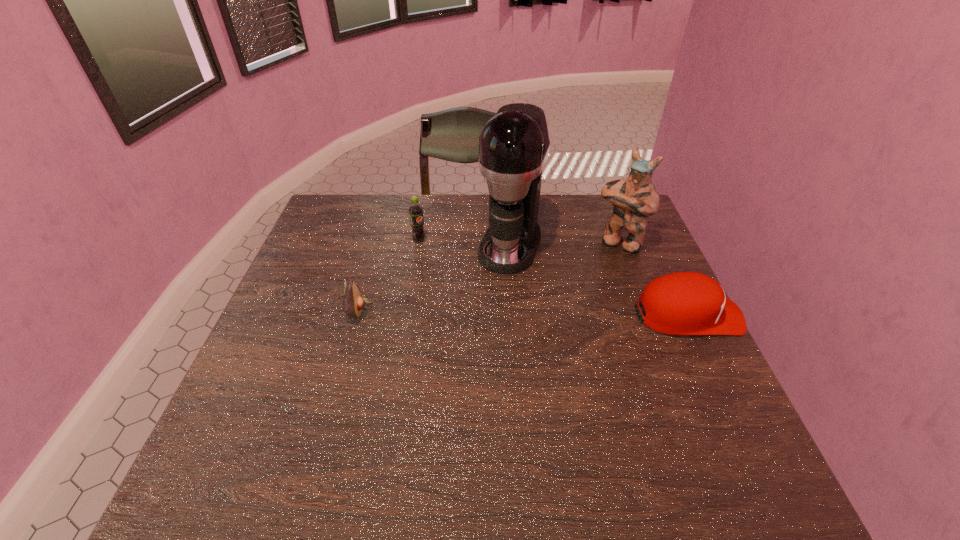
Where is `free space located on the front-facing side of the second tallest object`? free space located on the front-facing side of the second tallest object is located at coordinates (559, 326).

Locate an element on the screen. The height and width of the screenshot is (540, 960). free space located place cup under the spout of the tallest object is located at coordinates (481, 324).

I want to click on free space located 0.280m place cup under the spout of the tallest object, so click(x=471, y=348).

This screenshot has height=540, width=960. I want to click on free spot located 0.340m place cup under the spout of the tallest object, so click(463, 368).

This screenshot has height=540, width=960. In order to click on blank space located on the front label of the second object from left to right in this screenshot , I will do `click(455, 268)`.

Where is `free space located 0.400m on the front label of the second object from left to right`? The image size is (960, 540). free space located 0.400m on the front label of the second object from left to right is located at coordinates (518, 316).

The width and height of the screenshot is (960, 540). I want to click on vacant area located 0.230m on the front label of the second object from left to right, so (x=474, y=282).

You are a GUI agent. You are given a task and a screenshot of the screen. Output one action in this format:
    pyautogui.click(x=<x>, y=<y>)
    Task: Click on the figurine that is positioned at the far edge
    The height and width of the screenshot is (540, 960).
    Given the screenshot: What is the action you would take?
    pyautogui.click(x=634, y=199)

Image resolution: width=960 pixels, height=540 pixels. I want to click on coffee maker that is at the far edge, so click(x=514, y=144).

Find the location of `baseball cap at the right edge`. baseball cap at the right edge is located at coordinates (683, 303).